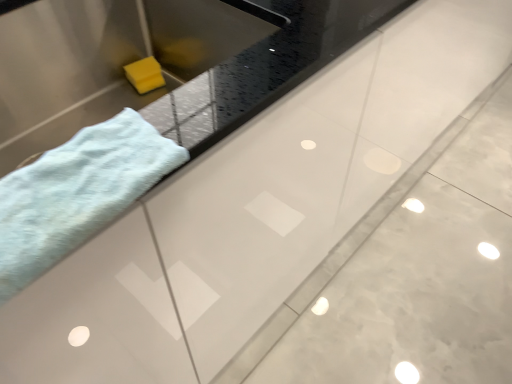
Question: Considering the relative positions of matte stainless steel sink at left and soft blue towel at left in the image provided, is matte stainless steel sink at left to the left or to the right of soft blue towel at left?

Choices:
 (A) right
 (B) left

Answer: (B)

Question: Looking at their shapes, would you say matte stainless steel sink at left is wider or thinner than soft blue towel at left?

Choices:
 (A) wide
 (B) thin

Answer: (A)

Question: From the image's perspective, is matte stainless steel sink at left above or below soft blue towel at left?

Choices:
 (A) below
 (B) above

Answer: (B)

Question: Considering their positions, is soft blue towel at left located in front of or behind matte stainless steel sink at left?

Choices:
 (A) behind
 (B) front

Answer: (B)

Question: In terms of width, does soft blue towel at left look wider or thinner when compared to matte stainless steel sink at left?

Choices:
 (A) thin
 (B) wide

Answer: (A)

Question: Considering the relative positions of soft blue towel at left and matte stainless steel sink at left in the image provided, is soft blue towel at left to the left or to the right of matte stainless steel sink at left?

Choices:
 (A) left
 (B) right

Answer: (B)

Question: Considering the positions of soft blue towel at left and matte stainless steel sink at left in the image, is soft blue towel at left taller or shorter than matte stainless steel sink at left?

Choices:
 (A) short
 (B) tall

Answer: (A)